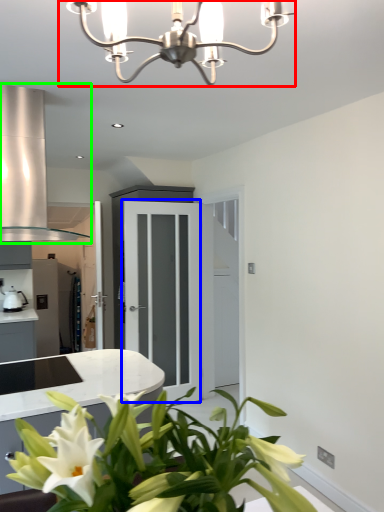
Question: Which object is the farthest from lamp (highlighted by a red box)? Choose among these: glass door (highlighted by a blue box) or exhaust hood (highlighted by a green box).

Choices:
 (A) glass door
 (B) exhaust hood

Answer: (A)